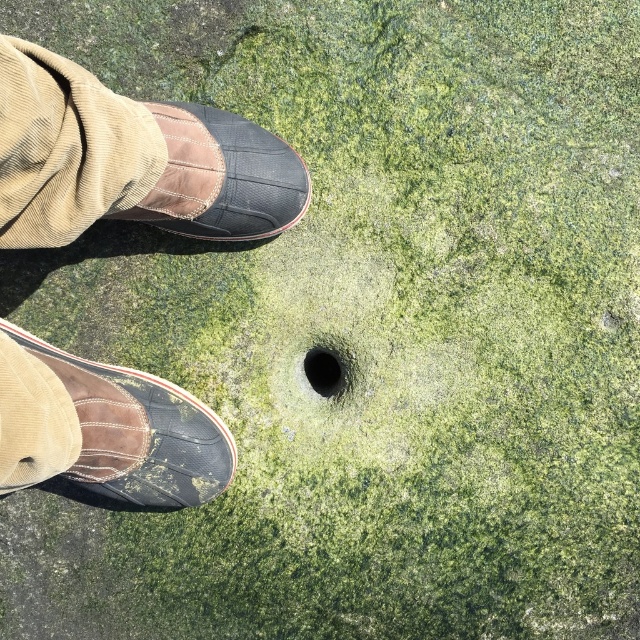
Is point (20, 472) positioned behind point (10, 97)?

Yes, point (20, 472) is farther from viewer.

Describe the element at coordinates (131, 161) in the screenshot. I see `brown leather boot at lower left` at that location.

Does point (12, 456) lie in front of point (12, 188)?

No.

This screenshot has height=640, width=640. What are the coordinates of `brown leather boot at lower left` in the screenshot? It's located at (131, 161).

Is corduroy pants at upper left to the left of black rubber hole at center from the viewer's perspective?

Yes, corduroy pants at upper left is to the left of black rubber hole at center.

Is corduroy pants at upper left thinner than black rubber hole at center?

Incorrect, corduroy pants at upper left's width is not less than black rubber hole at center's.

Describe the element at coordinates (67, 147) in the screenshot. The height and width of the screenshot is (640, 640). I see `corduroy pants at upper left` at that location.

I want to click on corduroy pants at upper left, so click(x=67, y=147).

Which of these two, brown leather boot at lower left or brown suede shoe at lower left, stands shorter?

Standing shorter between the two is brown suede shoe at lower left.

Who is lower down, brown leather boot at lower left or brown suede shoe at lower left?

Positioned lower is brown suede shoe at lower left.

Is point (58, 468) more distant than point (209, 492)?

No, (58, 468) is in front of (209, 492).

This screenshot has height=640, width=640. I want to click on brown leather boot at lower left, so coord(131,161).